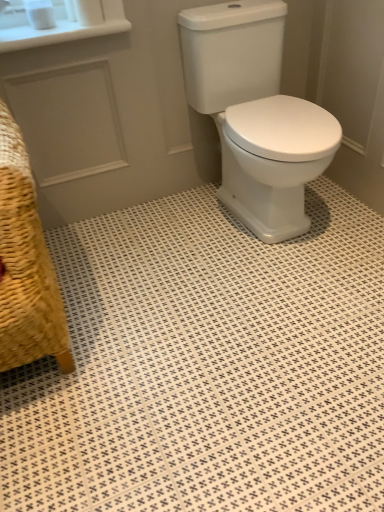
You are a GUI agent. You are given a task and a screenshot of the screen. Output one action in this format:
    pyautogui.click(x=<x>, y=<y>)
    Task: Click on the vacant point above white glossy ceramic tile at center (from a real-world perspective)
    
    Given the screenshot: What is the action you would take?
    pyautogui.click(x=201, y=302)